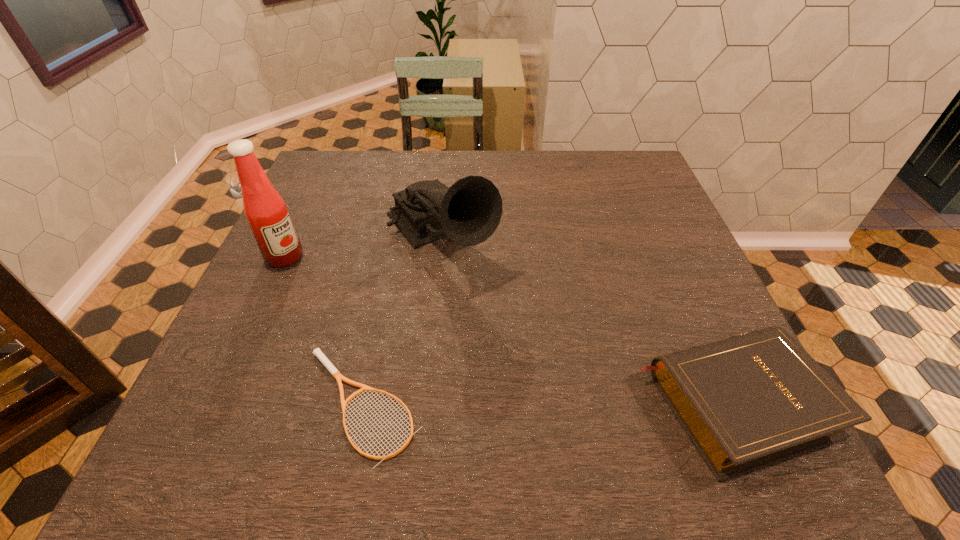
You are a GUI agent. You are given a task and a screenshot of the screen. Output one action in this format:
    pyautogui.click(x=<x>, y=<y>)
    Task: Click on the vacant region at the left edge of the desktop
    Image resolution: width=960 pixels, height=540 pixels.
    Given the screenshot: What is the action you would take?
    pyautogui.click(x=296, y=327)

Locate an element on the screen. vacant region at the right edge of the desktop is located at coordinates (682, 302).

Find the location of `free region at the far right corner of the desktop`. free region at the far right corner of the desktop is located at coordinates (637, 151).

Locate an element on the screen. Image resolution: width=960 pixels, height=540 pixels. blank region between the phonograph_record and the leftmost object is located at coordinates (362, 247).

I want to click on free space between the tennis racket and the leftmost object, so click(324, 330).

Identify the location of vacant space in between the rightmost object and the leftmost object. (510, 329).

Where is `free space between the phonograph_record and the tennis racket`? free space between the phonograph_record and the tennis racket is located at coordinates [x=400, y=321].

At what (x,y) coordinates should I click in order to perform the action: click on vacant space that is in between the second tallest object and the shortest object. Please return your answer as a coordinate pair (x, y). This screenshot has height=540, width=960. Looking at the image, I should click on (400, 321).

Where is `vacant space that is in between the condiment and the shortest object`? The height and width of the screenshot is (540, 960). vacant space that is in between the condiment and the shortest object is located at coordinates (324, 330).

At what (x,y) coordinates should I click in order to perform the action: click on free space between the rightmost object and the leftmost object. Please return your answer as a coordinate pair (x, y). Looking at the image, I should click on (510, 329).